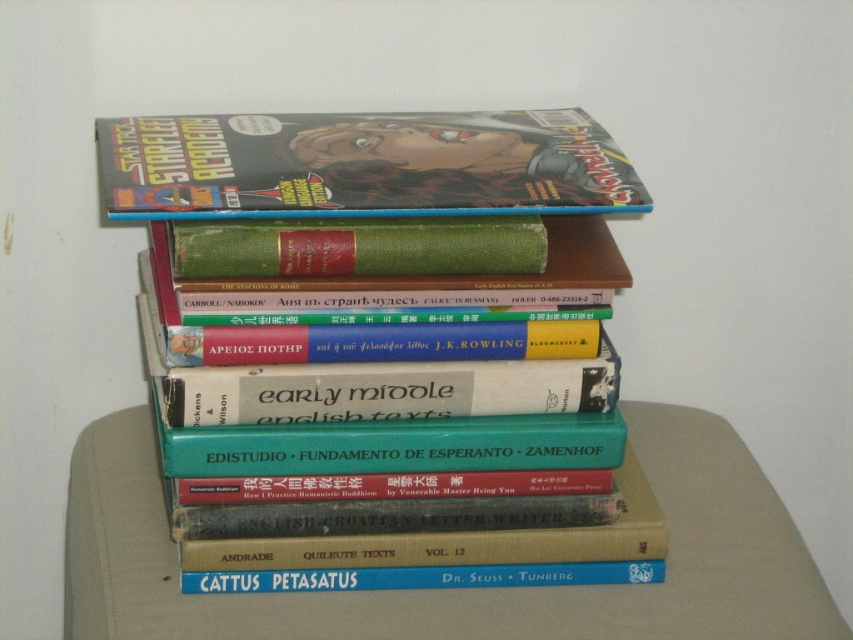
You are organizing a bookshelf and see the smooth beige table at center and the matte comic book at center. Which object is positioned lower from the floor?

The smooth beige table at center is located below the matte comic book at center, so the smooth beige table at center is positioned lower from the floor.

You are organizing a small display and have a smooth beige table at center and a matte comic book at center. Which object can accommodate more items placed on top of it?

The smooth beige table at center is bigger than the matte comic book at center, so it can accommodate more items placed on top of it.